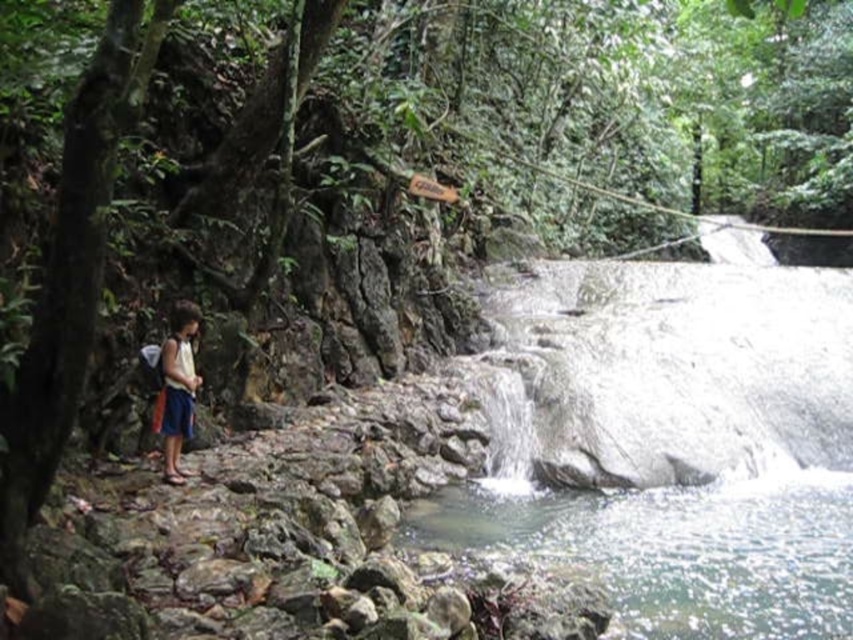
You are standing at the base of the waterfall and want to take a photo of the point at coordinates (538, 538). If your camera has a maximum zoom range of 10 meters, will you be able to capture the point clearly?

The point at coordinates (538, 538) is 8.23 meters away from you. Since your camera can zoom up to 10 meters, you will be able to capture the point clearly within the maximum zoom range.

You are a hiker who wants to cross the clear water at center to reach the other side. The blue denim shorts at left are part of your clothing. Can you safely cross the water without getting your shorts wet?

The clear water at center has a lesser height compared to blue denim shorts at left, so the water is not deep enough to reach the height of the blue denim shorts at left. Therefore, you can safely cross the water without getting your shorts wet.

You are standing on the rocky path near the base of the waterfall. You want to take a photo of the clear water at center. Where should you aim your camera to capture it?

You should aim your camera at the point with coordinates (675, 548) to capture the clear water at center.